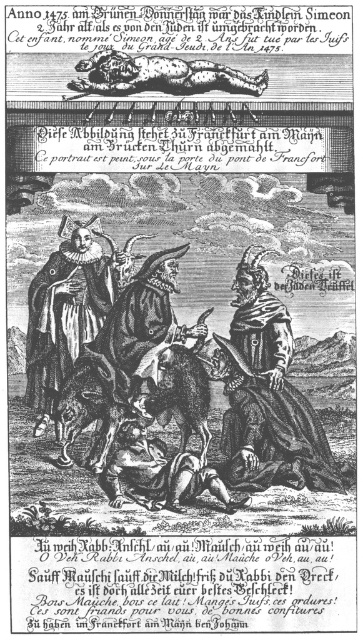
Question: Which point is closer to the camera taking this photo?

Choices:
 (A) (26, 397)
 (B) (178, 502)
 (C) (75, 86)

Answer: (B)

Question: Which of the following is the closest to the observer?

Choices:
 (A) brown leather dog at upper center
 (B) matte black robe at center
 (C) brown leather boots at lower center
 (D) wooden staff at center

Answer: (C)

Question: Which point appears closest to the camera in this image?

Choices:
 (A) (135, 476)
 (B) (242, 436)

Answer: (A)

Question: Is matte black robe at center below brown leather boots at lower center?

Choices:
 (A) no
 (B) yes

Answer: (A)

Question: Is wooden staff at center thinner than matte black robe at center?

Choices:
 (A) yes
 (B) no

Answer: (B)

Question: In this image, where is brown leather boots at lower center located relative to brown leather dog at upper center?

Choices:
 (A) above
 (B) below

Answer: (B)